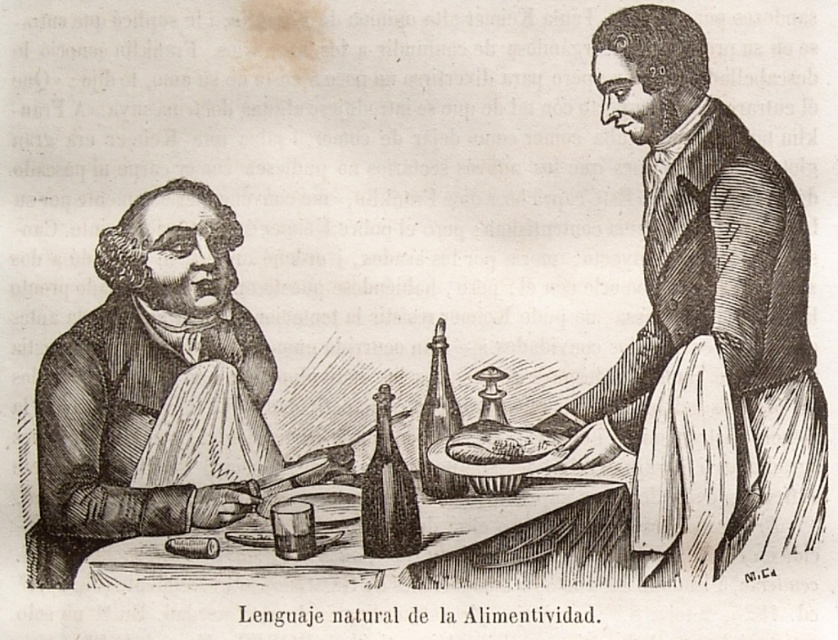
You are a guest at this table and need to place your napkin on your lap. Which item, the smooth paper napkin at left or the smooth brown bread at center, is more appropriate to use as a napkin?

The smooth paper napkin at left is more appropriate to use as a napkin because it is larger in size compared to the smooth brown bread at center.

Based on the coordinates provided, which object is located at point (705, 323)?

The smooth black coat at right is located at point (705, 323).